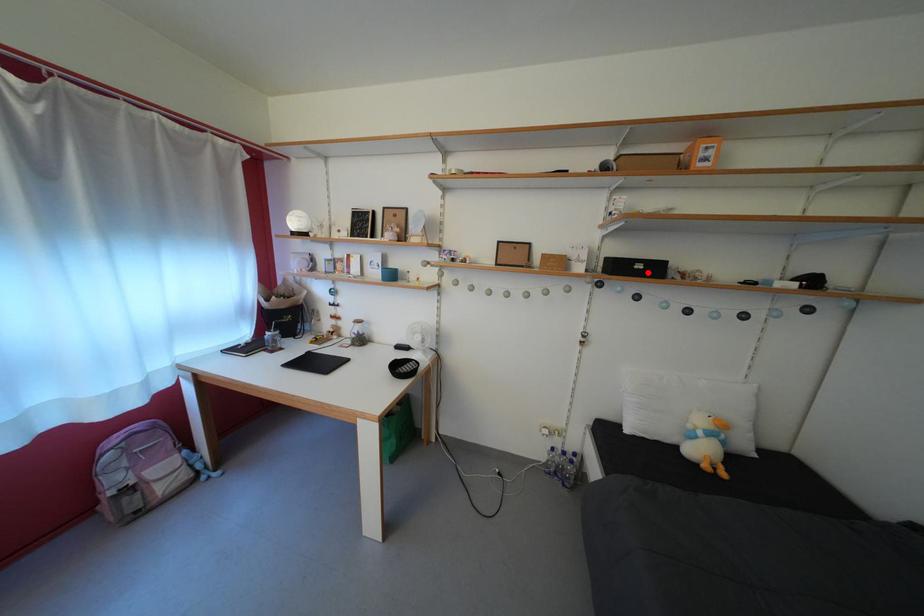
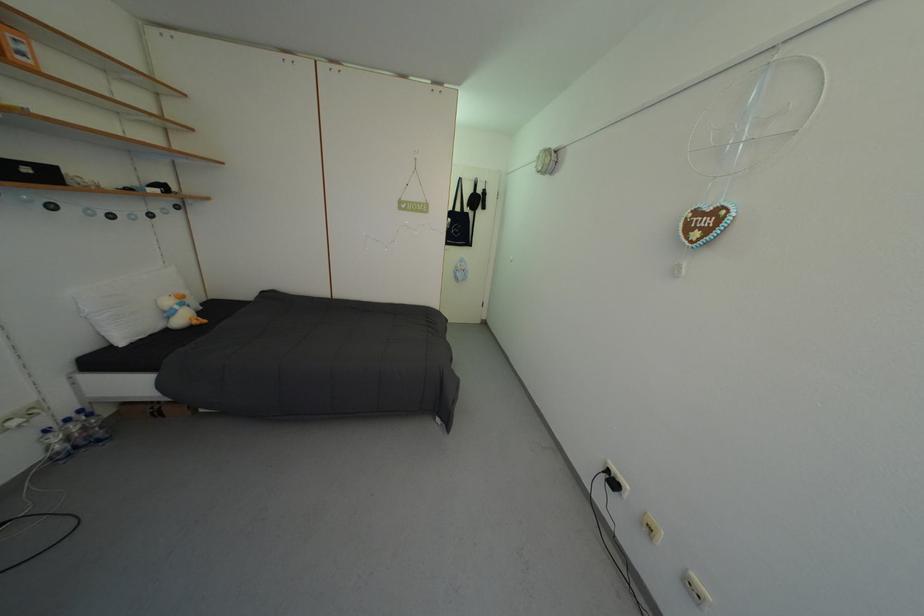
Where in the second image is the point corresponding to the highlighted location from the first image?

(35, 176)